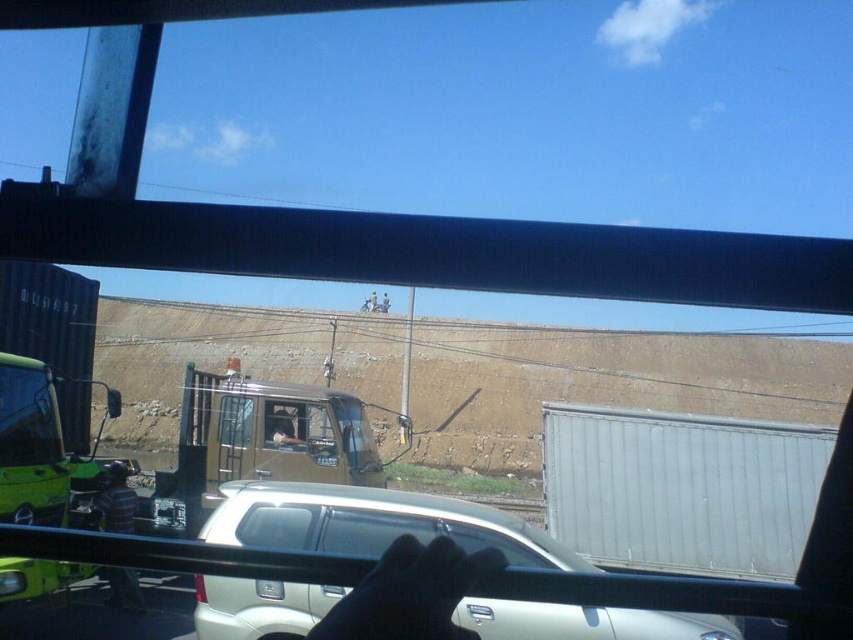
Is white matte car at center thinner than clear glass window at center?

Yes, white matte car at center is thinner than clear glass window at center.

Where is `white matte car at center`? This screenshot has width=853, height=640. white matte car at center is located at coordinates (392, 522).

Can you confirm if clear glass window at center is positioned below transparent glass window at center?

Correct, clear glass window at center is located below transparent glass window at center.

Between clear glass window at center and transparent glass window at center, which one is positioned lower?

clear glass window at center

Does point (279, 445) lie in front of point (234, 408)?

Yes, point (279, 445) is in front of point (234, 408).

The width and height of the screenshot is (853, 640). In order to click on clear glass window at center in this screenshot , I will do `click(300, 429)`.

Is point (517, 618) behind point (436, 552)?

Yes, point (517, 618) is farther from viewer.

Locate an element on the screen. white matte car at center is located at coordinates (392, 522).

Between point (496, 513) and point (442, 630), which one is positioned behind?

Positioned behind is point (496, 513).

The image size is (853, 640). Find the location of `white matte car at center`. white matte car at center is located at coordinates (392, 522).